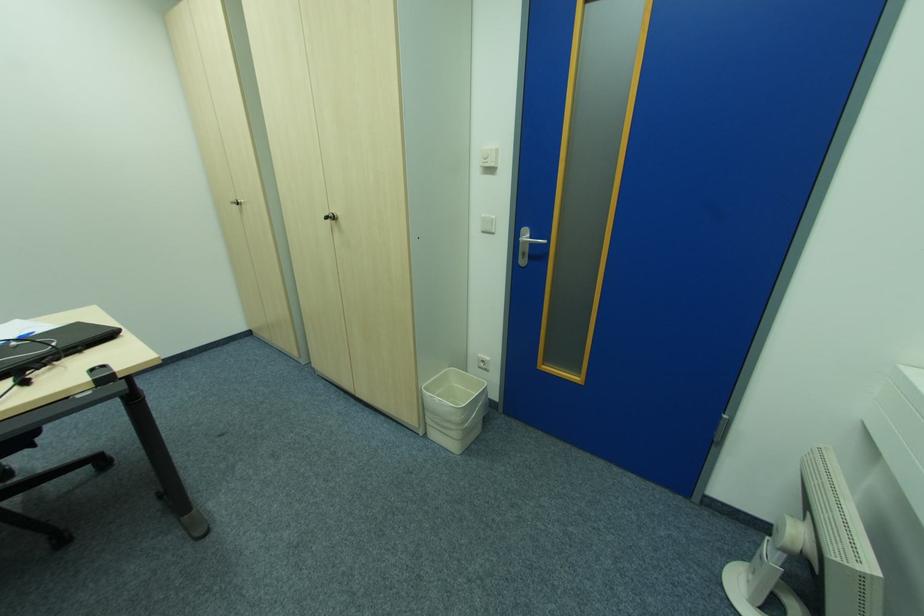
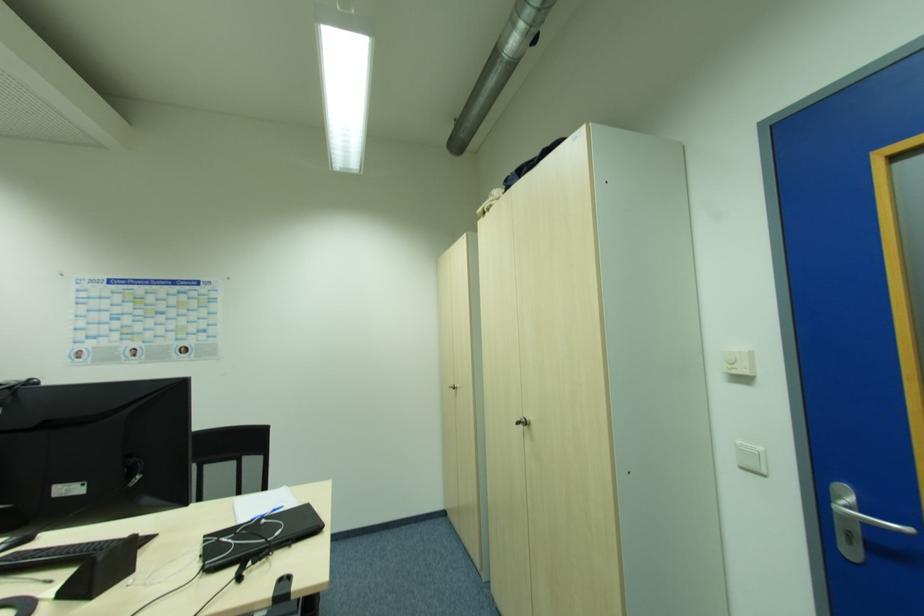
The images are taken continuously from a first-person perspective. In which direction is your viewpoint rotating?

The camera rotated toward left-up.